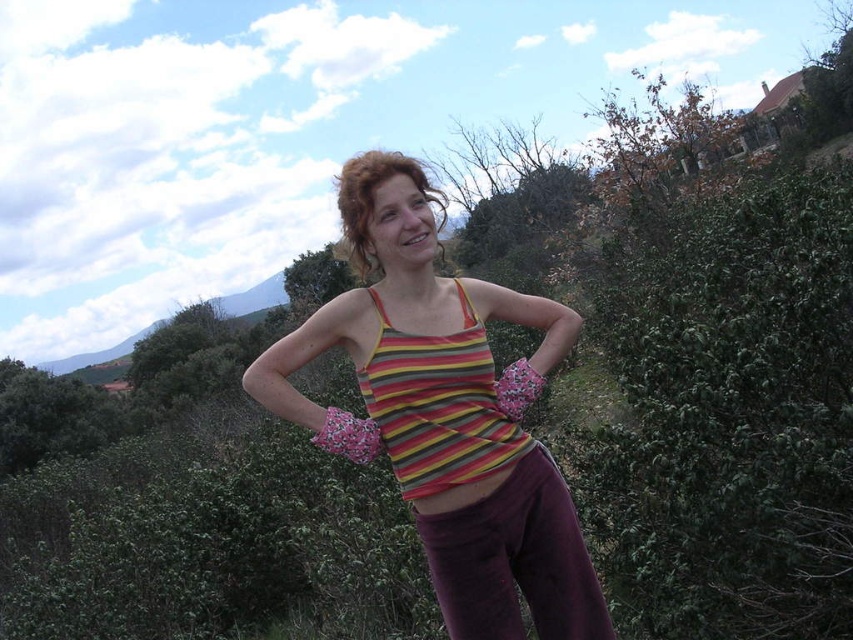
Is point (570, 595) farther from camera compared to point (509, 470)?

Yes, point (570, 595) is behind point (509, 470).

Is striped fabric tank top at center positioned behind striped fabric hip at center?

No, striped fabric tank top at center is closer to the viewer.

Who is more forward, [514,406] or [416,502]?

Point [416,502] is more forward.

This screenshot has height=640, width=853. What are the coordinates of `striped fabric tank top at center` in the screenshot? It's located at (447, 412).

Can you confirm if green leafy hedge at right is wider than striped fabric bikini top at center?

No, green leafy hedge at right is not wider than striped fabric bikini top at center.

Is green leafy hedge at right above striped fabric bikini top at center?

Incorrect, green leafy hedge at right is not positioned above striped fabric bikini top at center.

Is point (662, 492) closer to camera compared to point (386, 317)?

No.

Locate an element on the screen. This screenshot has height=640, width=853. green leafy hedge at right is located at coordinates (730, 413).

Between striped fabric bikini top at center and striped fabric hip at center, which one has more height?

striped fabric bikini top at center is taller.

Describe the element at coordinates (438, 404) in the screenshot. I see `striped fabric bikini top at center` at that location.

This screenshot has height=640, width=853. Describe the element at coordinates (438, 404) in the screenshot. I see `striped fabric bikini top at center` at that location.

The image size is (853, 640). In order to click on striped fabric bikini top at center in this screenshot , I will do `click(438, 404)`.